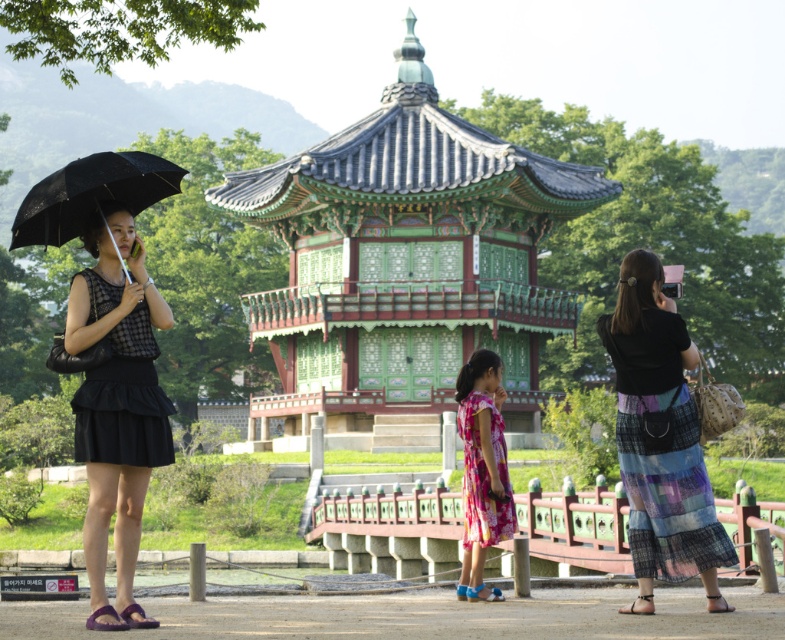
You are standing in the outdoor scene and want to walk from point [495,497] to point [139,157]. Which direction should you face to walk directly towards your destination?

To walk directly from point [495,497] to point [139,157], you should face southwest because point [139,157] is located southwest of point [495,497].

You are standing in the outdoor scene and want to approach both the black matte dress at left and the multicolored woven skirt at right. Which one should you head towards first to reach the one closer to you?

You should head towards the black matte dress at left first because it is closer to the viewer than the multicolored woven skirt at right.